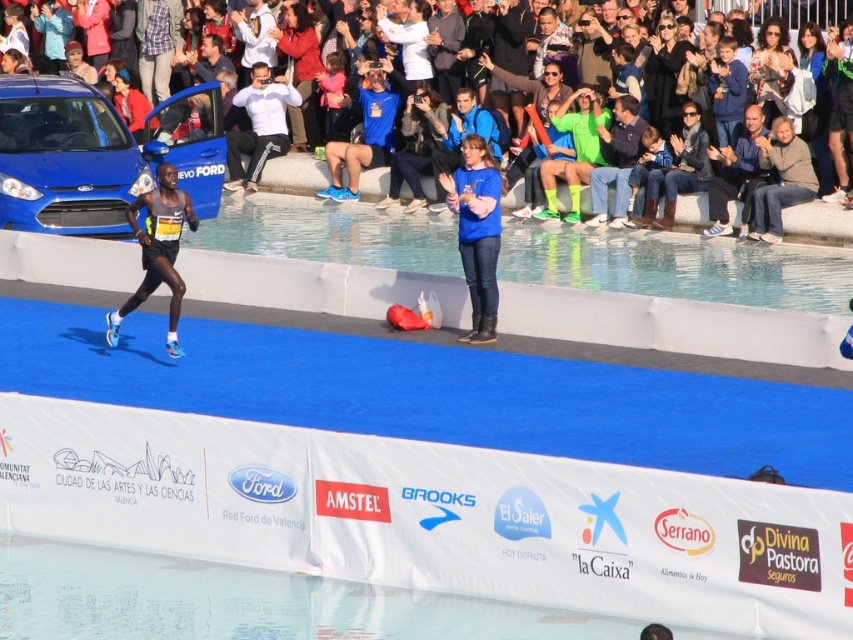
Can you confirm if light brown leather jacket at upper right is positioned above blue jeans at center?

No, light brown leather jacket at upper right is not above blue jeans at center.

Which is behind, point (775, 211) or point (717, 227)?

Positioned behind is point (717, 227).

Is point (769, 204) farther from viewer compared to point (722, 166)?

That is False.

Find the location of a particular element. This screenshot has width=853, height=640. light brown leather jacket at upper right is located at coordinates (781, 179).

In the scene shown: Which is more to the left, light blue running shoes at center or white matte pants at center?

From the viewer's perspective, white matte pants at center appears more on the left side.

What do you see at coordinates (157, 250) in the screenshot? The height and width of the screenshot is (640, 853). I see `light blue running shoes at center` at bounding box center [157, 250].

Does point (177, 284) lie in front of point (270, 76)?

That is True.

This screenshot has width=853, height=640. Find the location of `light blue running shoes at center`. light blue running shoes at center is located at coordinates (157, 250).

Between light brown leather jacket at upper right and dark blue shirt at center, which one appears on the left side from the viewer's perspective?

dark blue shirt at center

In the scene shown: Does light brown leather jacket at upper right appear on the left side of dark blue shirt at center?

In fact, light brown leather jacket at upper right is to the right of dark blue shirt at center.

Is point (772, 154) behind point (607, 161)?

No, it is in front of (607, 161).

Locate an element on the screen. light brown leather jacket at upper right is located at coordinates (781, 179).